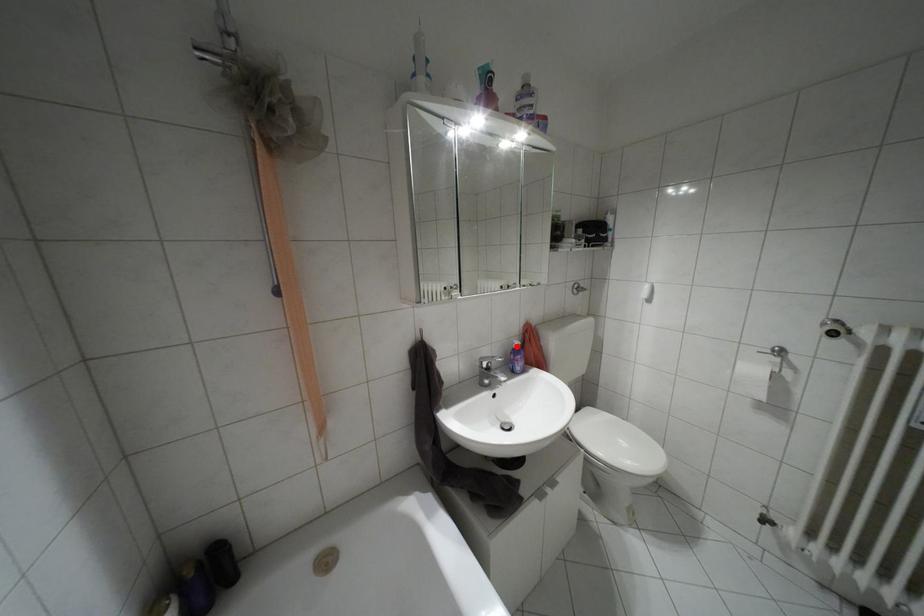
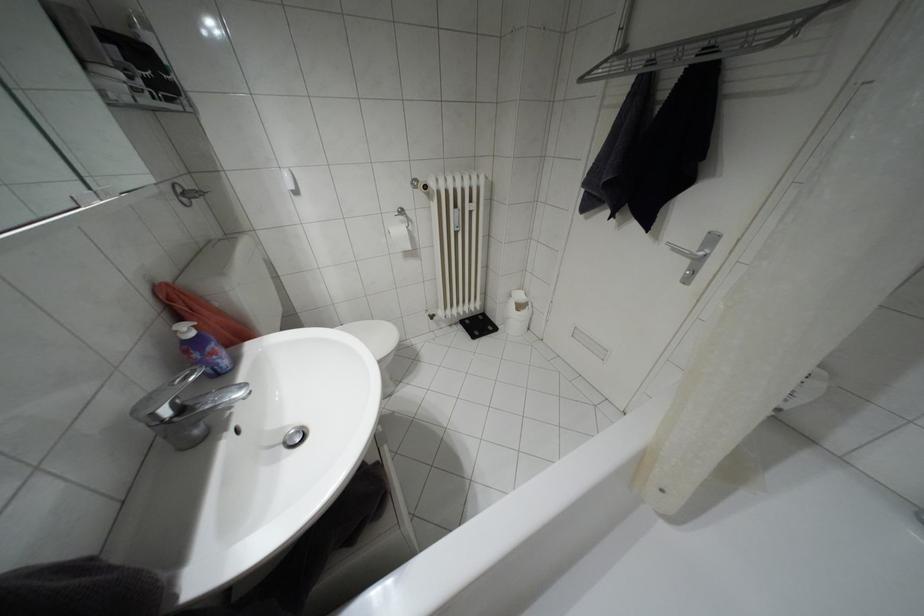
Question: I am providing you with two images of the same scene from different viewpoints. A red point is shown in image1. For the corresponding object point in image2, is it positioned nearer or farther from the camera?

Choices:
 (A) Nearer
 (B) Farther

Answer: (A)